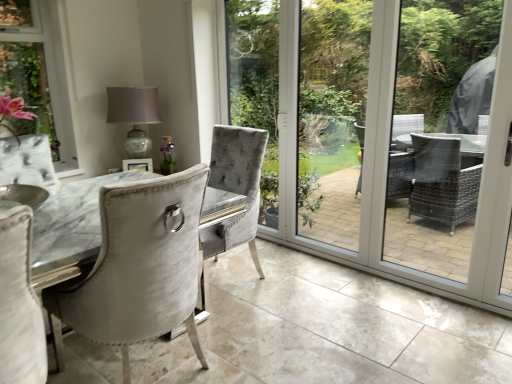
Image resolution: width=512 pixels, height=384 pixels. What do you see at coordinates (497, 176) in the screenshot? I see `white glossy screen door at right, which is the second screen door in left-to-right order` at bounding box center [497, 176].

The height and width of the screenshot is (384, 512). Describe the element at coordinates (139, 265) in the screenshot. I see `satin white chair at center` at that location.

Describe the element at coordinates (384, 134) in the screenshot. This screenshot has width=512, height=384. I see `clear glass screen door at center, the second screen door viewed from the right` at that location.

Identify the location of white glossy screen door at right, which is the second screen door in left-to-right order. The width and height of the screenshot is (512, 384). (497, 176).

Consider the image. Would you say matte glass table lamp at upper center is inside or outside satin white chair at center?

matte glass table lamp at upper center is not inside satin white chair at center, it's outside.

Between matte glass table lamp at upper center and satin white chair at center, which one has more height?

With more height is satin white chair at center.

Consider the image. From the image's perspective, would you say matte glass table lamp at upper center is positioned over satin white chair at center?

Yes.

Is point (134, 106) farther from camera compared to point (94, 331)?

Yes, point (134, 106) is behind point (94, 331).

Is clear glass screen door at center, the 1th screen door viewed from the left, oriented towards white glossy screen door at right, which ranks as the 1th screen door in right-to-left order?

No, clear glass screen door at center, the 1th screen door viewed from the left, does not turn towards white glossy screen door at right, which ranks as the 1th screen door in right-to-left order.

Locate an element on the screen. This screenshot has width=512, height=384. screen door lying in front of the white glossy screen door at right, which is the second screen door in left-to-right order is located at coordinates (384, 134).

Based on the photo, is clear glass screen door at center, the 1th screen door viewed from the left, not close to white glossy screen door at right, which is the second screen door in left-to-right order?

That's right, there is a large distance between clear glass screen door at center, the 1th screen door viewed from the left, and white glossy screen door at right, which is the second screen door in left-to-right order.

Looking at this image, which is correct: clear glass screen door at center, the 1th screen door viewed from the left, is inside white glossy screen door at right, which is the second screen door in left-to-right order, or outside of it?

clear glass screen door at center, the 1th screen door viewed from the left, exists outside the volume of white glossy screen door at right, which is the second screen door in left-to-right order.

From a real-world perspective, which is physically below, clear glass screen door at center, the second screen door viewed from the right, or satin white chair at center?

satin white chair at center is physically lower.

Is point (266, 59) positioned before point (129, 239)?

No, (266, 59) is further to viewer.

Is clear glass screen door at center, the 1th screen door viewed from the left, not within satin white chair at center?

Yes, clear glass screen door at center, the 1th screen door viewed from the left, is outside of satin white chair at center.

Considering the sizes of objects clear glass screen door at center, the second screen door viewed from the right, and satin white chair at center in the image provided, who is wider, clear glass screen door at center, the second screen door viewed from the right, or satin white chair at center?

Wider between the two is satin white chair at center.

The image size is (512, 384). In order to click on chair in front of the white glossy screen door at right, which ranks as the 1th screen door in right-to-left order in this screenshot , I will do `click(139, 265)`.

Is white glossy screen door at right, which ranks as the 1th screen door in right-to-left order, to the left of satin white chair at center from the viewer's perspective?

Incorrect, white glossy screen door at right, which ranks as the 1th screen door in right-to-left order, is not on the left side of satin white chair at center.

From the picture: Is white glossy screen door at right, which ranks as the 1th screen door in right-to-left order, with satin white chair at center?

No, white glossy screen door at right, which ranks as the 1th screen door in right-to-left order, is not beside satin white chair at center.

Based on the photo, from the image's perspective, is white glossy screen door at right, which is the second screen door in left-to-right order, located above or below satin white chair at center?

white glossy screen door at right, which is the second screen door in left-to-right order, is above satin white chair at center.

Is point (486, 306) positioned before point (147, 92)?

Yes.

From the image's perspective, is white glossy screen door at right, which is the second screen door in left-to-right order, located above or below matte glass table lamp at upper center?

white glossy screen door at right, which is the second screen door in left-to-right order, is situated lower than matte glass table lamp at upper center in the image.

Does white glossy screen door at right, which is the second screen door in left-to-right order, have a smaller size compared to matte glass table lamp at upper center?

Indeed, white glossy screen door at right, which is the second screen door in left-to-right order, has a smaller size compared to matte glass table lamp at upper center.

Is white glossy screen door at right, which is the second screen door in left-to-right order, further to camera compared to matte glass table lamp at upper center?

No, white glossy screen door at right, which is the second screen door in left-to-right order, is closer to the viewer.

Which of these two, clear glass screen door at center, the 1th screen door viewed from the left, or matte glass table lamp at upper center, is wider?

matte glass table lamp at upper center is wider.

Which of these two, clear glass screen door at center, the 1th screen door viewed from the left, or matte glass table lamp at upper center, is bigger?

Bigger between the two is clear glass screen door at center, the 1th screen door viewed from the left.

Is clear glass screen door at center, the 1th screen door viewed from the left, taller or shorter than matte glass table lamp at upper center?

Clearly, clear glass screen door at center, the 1th screen door viewed from the left, is taller compared to matte glass table lamp at upper center.

Are clear glass screen door at center, the 1th screen door viewed from the left, and matte glass table lamp at upper center far apart?

Yes.

Can you confirm if matte glass table lamp at upper center is taller than clear glass screen door at center, the second screen door viewed from the right?

In fact, matte glass table lamp at upper center may be shorter than clear glass screen door at center, the second screen door viewed from the right.

Based on the photo, from a real-world perspective, between matte glass table lamp at upper center and clear glass screen door at center, the 1th screen door viewed from the left, who is vertically lower?

From a 3D spatial view, matte glass table lamp at upper center is below.

Looking at this image, which object is more forward, matte glass table lamp at upper center or clear glass screen door at center, the 1th screen door viewed from the left?

clear glass screen door at center, the 1th screen door viewed from the left, is more forward.

Which is in front, point (143, 89) or point (375, 239)?

Point (375, 239)

Where is `chair lying on the right of matte glass table lamp at upper center`? chair lying on the right of matte glass table lamp at upper center is located at coordinates (139, 265).

Where is `screen door behind the clear glass screen door at center, the second screen door viewed from the right`? This screenshot has width=512, height=384. screen door behind the clear glass screen door at center, the second screen door viewed from the right is located at coordinates 497,176.

When comparing their distances from clear glass screen door at center, the second screen door viewed from the right, does matte glass table lamp at upper center or white glossy screen door at right, which ranks as the 1th screen door in right-to-left order, seem closer?

Based on the image, matte glass table lamp at upper center appears to be nearer to clear glass screen door at center, the second screen door viewed from the right.

Looking at the image, which one is located closer to satin white chair at center, clear glass screen door at center, the second screen door viewed from the right, or matte glass table lamp at upper center?

matte glass table lamp at upper center is closer to satin white chair at center.

Estimate the real-world distances between objects in this image. Which object is further from matte glass table lamp at upper center, clear glass screen door at center, the 1th screen door viewed from the left, or satin white chair at center?

The object further to matte glass table lamp at upper center is clear glass screen door at center, the 1th screen door viewed from the left.

Consider the image. When comparing their distances from satin white chair at center, does matte glass table lamp at upper center or white glossy screen door at right, which is the second screen door in left-to-right order, seem further?

Based on the image, matte glass table lamp at upper center appears to be further to satin white chair at center.

Considering their positions, is white glossy screen door at right, which is the second screen door in left-to-right order, positioned closer to clear glass screen door at center, the second screen door viewed from the right, than matte glass table lamp at upper center?

matte glass table lamp at upper center.

Based on the photo, considering their positions, is clear glass screen door at center, the second screen door viewed from the right, positioned further to matte glass table lamp at upper center than white glossy screen door at right, which ranks as the 1th screen door in right-to-left order?

The object further to matte glass table lamp at upper center is clear glass screen door at center, the second screen door viewed from the right.

Based on their spatial positions, is satin white chair at center or clear glass screen door at center, the second screen door viewed from the right, closer to matte glass table lamp at upper center?

Based on the image, satin white chair at center appears to be nearer to matte glass table lamp at upper center.

From the image, which object appears to be nearer to clear glass screen door at center, the second screen door viewed from the right, satin white chair at center or matte glass table lamp at upper center?

matte glass table lamp at upper center lies closer to clear glass screen door at center, the second screen door viewed from the right, than the other object.

Image resolution: width=512 pixels, height=384 pixels. What are the coordinates of `chair between matte glass table lamp at upper center and white glossy screen door at right, which is the second screen door in left-to-right order` in the screenshot? It's located at (139, 265).

Identify the location of screen door situated between matte glass table lamp at upper center and white glossy screen door at right, which is the second screen door in left-to-right order, from left to right. This screenshot has height=384, width=512. (384, 134).

At what (x,y) coordinates should I click in order to perform the action: click on screen door between satin white chair at center and white glossy screen door at right, which is the second screen door in left-to-right order. Please return your answer as a coordinate pair (x, y). This screenshot has width=512, height=384. Looking at the image, I should click on (384, 134).